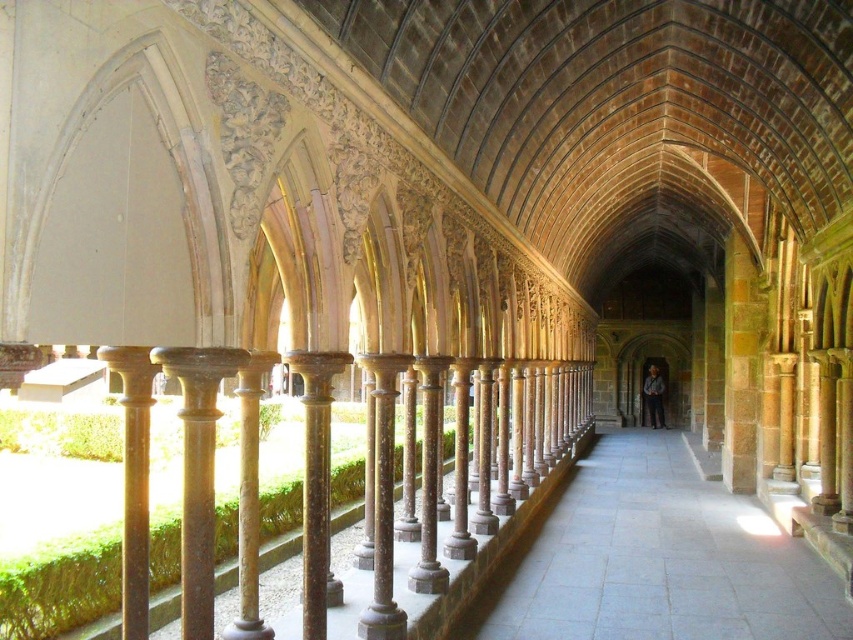
You are an architect examining the cloister. You need to determine the spatial relationship between the brown polished stone pillar at left and the wooden figure at center. Which object is located above the other?

The brown polished stone pillar at left is positioned over the wooden figure at center, meaning the pillar is above the wooden figure.